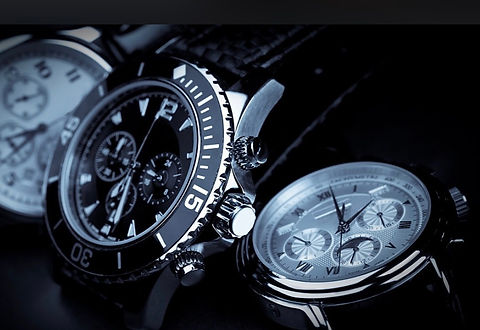
Locate an element on the screen. The image size is (480, 330). clock hands is located at coordinates (120, 202), (25, 144), (341, 234), (341, 204).